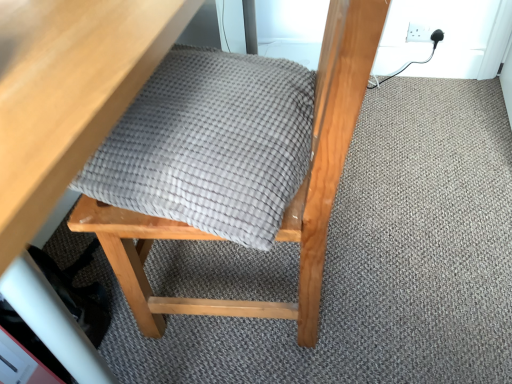
Question: From a real-world perspective, is white plastic socket at upper right beneath wooden table at upper left?

Choices:
 (A) yes
 (B) no

Answer: (A)

Question: From the image's perspective, does white plastic socket at upper right appear lower than wooden table at upper left?

Choices:
 (A) yes
 (B) no

Answer: (B)

Question: Is white plastic socket at upper right bigger than wooden table at upper left?

Choices:
 (A) yes
 (B) no

Answer: (B)

Question: Is white plastic socket at upper right positioned with its back to wooden table at upper left?

Choices:
 (A) yes
 (B) no

Answer: (B)

Question: Is white plastic socket at upper right smaller than wooden table at upper left?

Choices:
 (A) yes
 (B) no

Answer: (A)

Question: From a real-world perspective, is wooden table at upper left above or below gray woven blanket at center?

Choices:
 (A) above
 (B) below

Answer: (B)

Question: In the image, is wooden table at upper left positioned in front of or behind gray woven blanket at center?

Choices:
 (A) behind
 (B) front

Answer: (B)

Question: In terms of width, does wooden table at upper left look wider or thinner when compared to gray woven blanket at center?

Choices:
 (A) thin
 (B) wide

Answer: (B)

Question: In terms of height, does wooden table at upper left look taller or shorter compared to gray woven blanket at center?

Choices:
 (A) tall
 (B) short

Answer: (A)

Question: From a real-world perspective, is white plastic socket at upper right positioned above or below gray woven blanket at center?

Choices:
 (A) below
 (B) above

Answer: (A)

Question: Does point (438, 36) appear closer or farther from the camera than point (231, 52)?

Choices:
 (A) closer
 (B) farther

Answer: (B)

Question: Is white plastic socket at upper right wider or thinner than gray woven blanket at center?

Choices:
 (A) thin
 (B) wide

Answer: (A)

Question: Is white plastic socket at upper right in front of or behind gray woven blanket at center in the image?

Choices:
 (A) front
 (B) behind

Answer: (B)

Question: Is matte gray cushion at center taller or shorter than white plastic socket at upper right?

Choices:
 (A) tall
 (B) short

Answer: (A)

Question: Relative to white plastic socket at upper right, is matte gray cushion at center in front or behind?

Choices:
 (A) behind
 (B) front

Answer: (B)